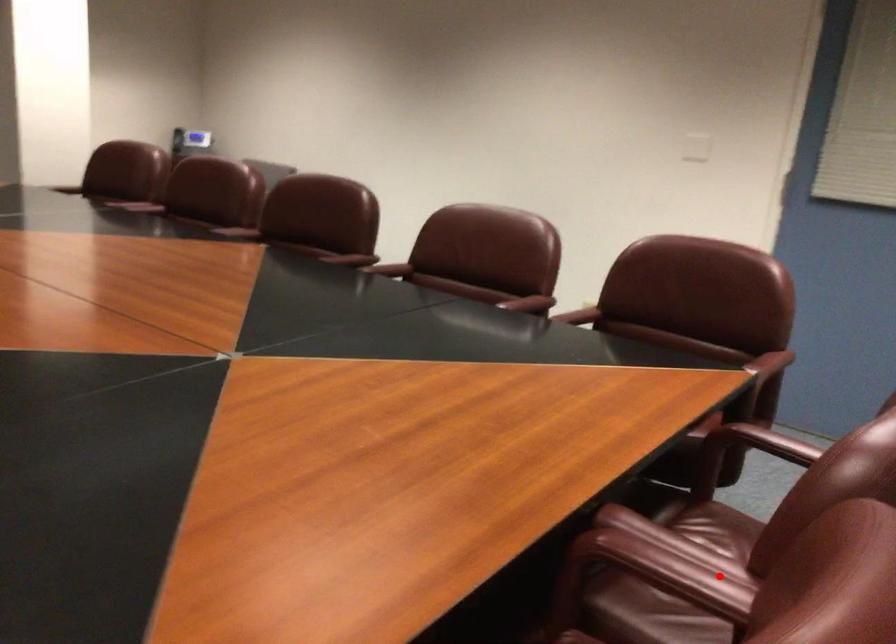
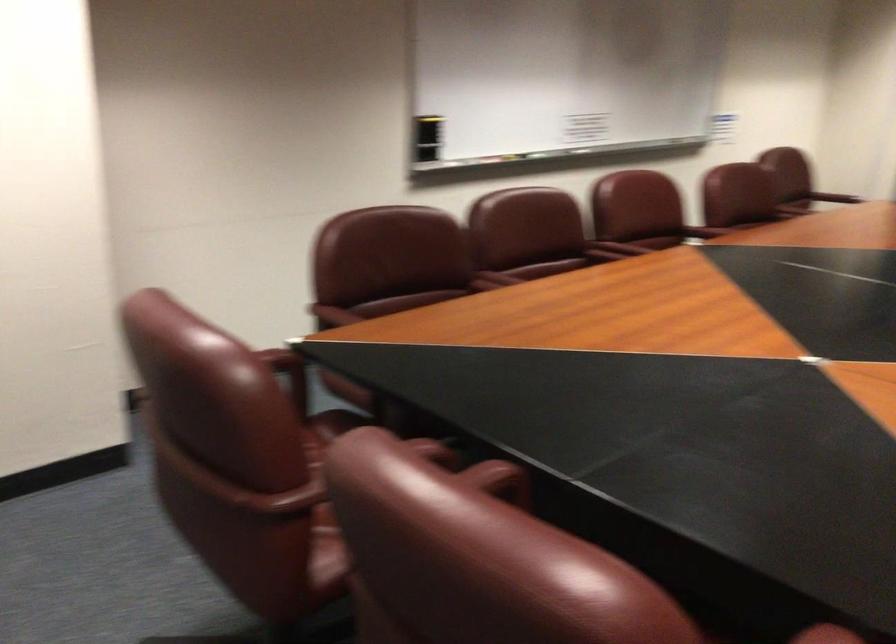
Question: I am providing you with two images of the same scene from different viewpoints. In image1, a red point is highlighted. Considering the same 3D point in image2, which of the following is correct?

Choices:
 (A) It is closer
 (B) It is farther

Answer: (B)